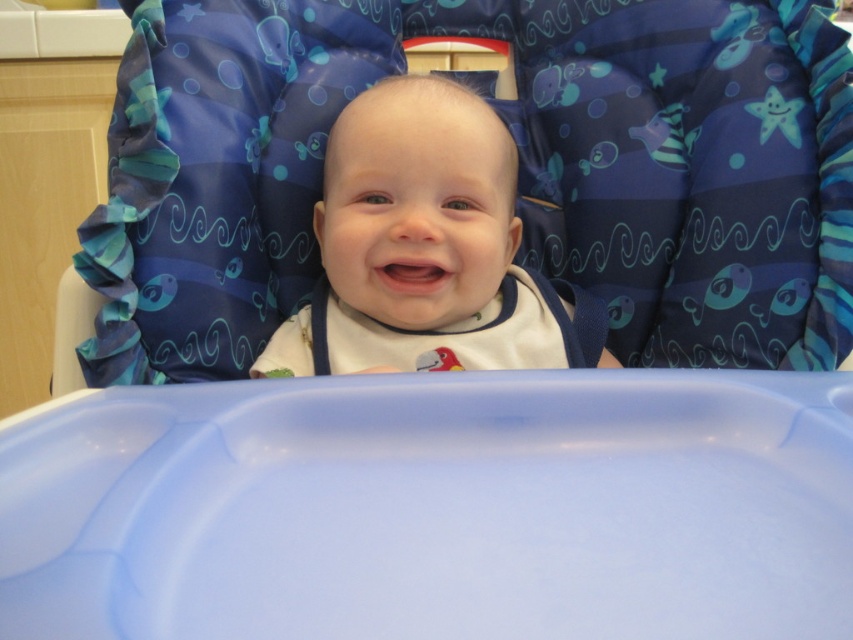
You are a parent preparing to feed your baby. You have a blue fabric feeding chair at upper center and a white fabric bib at center. Which item should you put on the baby first, the larger one or the smaller one?

The blue fabric feeding chair at upper center is larger than the white fabric bib at center. You should put the smaller item, the white fabric bib at center, on the baby first before placing them in the larger blue fabric feeding chair at upper center.

You are a parent trying to place a toy on the high chair tray. You have two points to choose from on the tray. The first point is at coordinate point(228, 365) and the second is at point(318, 365). Which point is closer to you so you can easily reach it?

Point(228, 365) is closer to the viewer than point(318, 365), so you should choose point(228, 365) to place the toy for easier reach.

You are a caregiver looking at the baby in the high chair. Where is the blue fabric feeding chair at upper center in relation to the white soft baby at center?

The blue fabric feeding chair at upper center is to the right of the white soft baby at center.